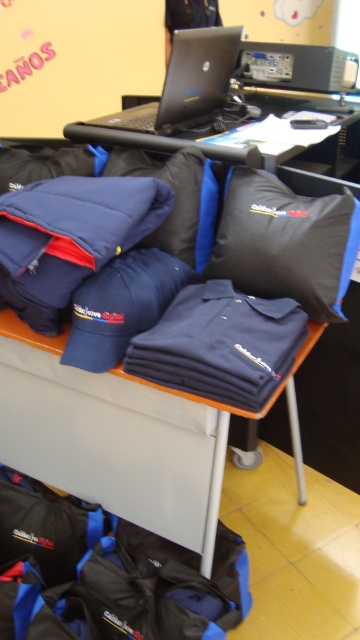
Consider the image. You are standing in front of the display table and want to pick up an item. If you move your hand towards the point at (150, 129) and the point at (218, 45), which point will you reach first?

You will reach the point at (150, 129) first because it is closer to you than the point at (218, 45).

In the scene shown: You are a delivery person who needs to place a package on the table. The package is 1.2 meters long. Can you fit it between the navy blue fabric shirt at center and the black glossy laptop at upper center without overlapping them?

The distance between the navy blue fabric shirt at center and the black glossy laptop at upper center is 1.06 meters. Since the package is 1.2 meters long, it cannot fit between them without overlapping.